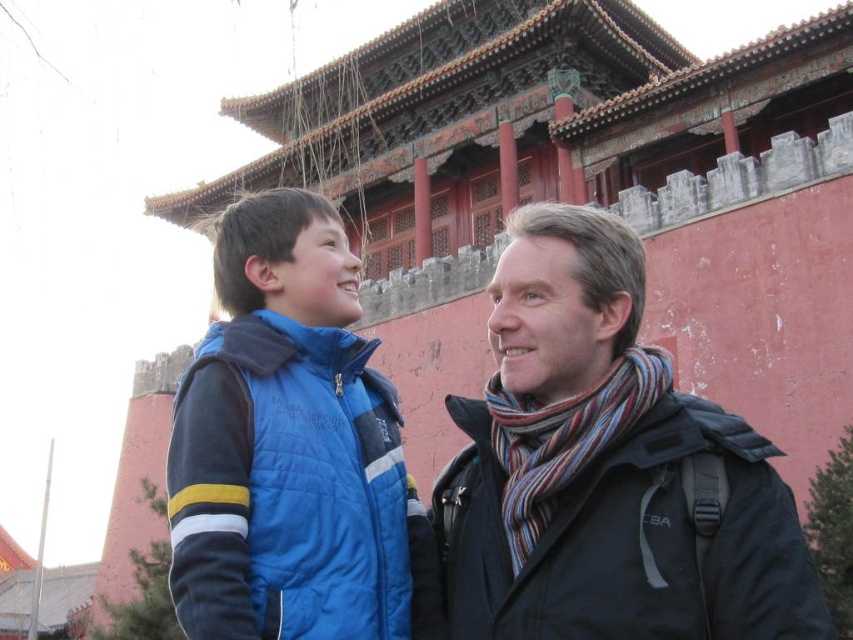
Is dark gray wool scarf at right to the right of blue quilted vest at center from the viewer's perspective?

Indeed, dark gray wool scarf at right is positioned on the right side of blue quilted vest at center.

Does dark gray wool scarf at right lie behind blue quilted vest at center?

No, it is in front of blue quilted vest at center.

Find the location of a particular element. The height and width of the screenshot is (640, 853). dark gray wool scarf at right is located at coordinates (605, 468).